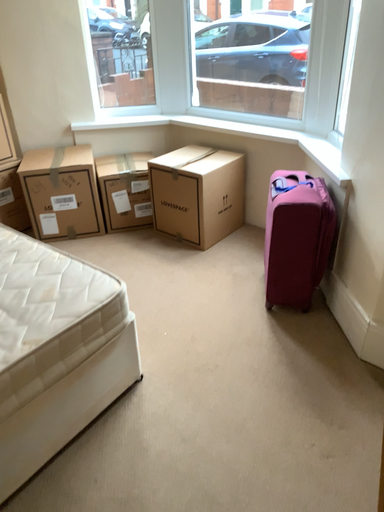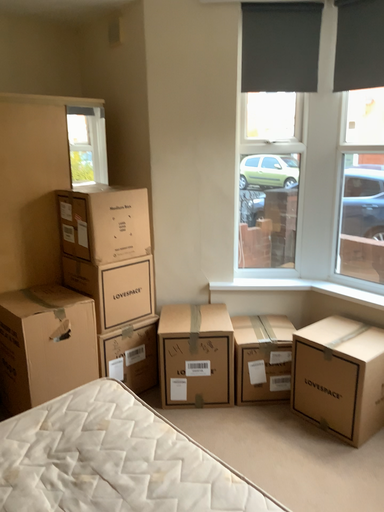
Question: Which way did the camera rotate in the video?

Choices:
 (A) rotated right
 (B) rotated left

Answer: (B)